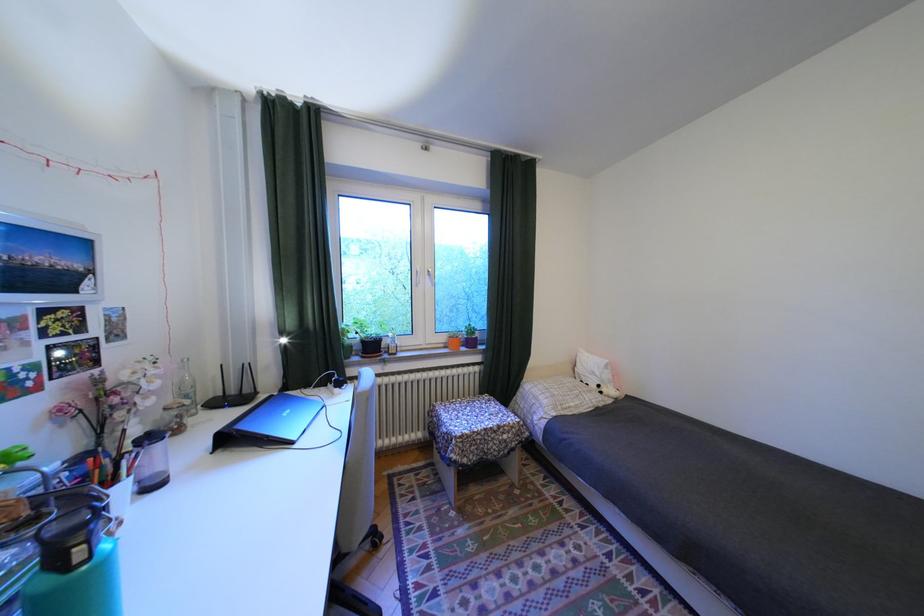
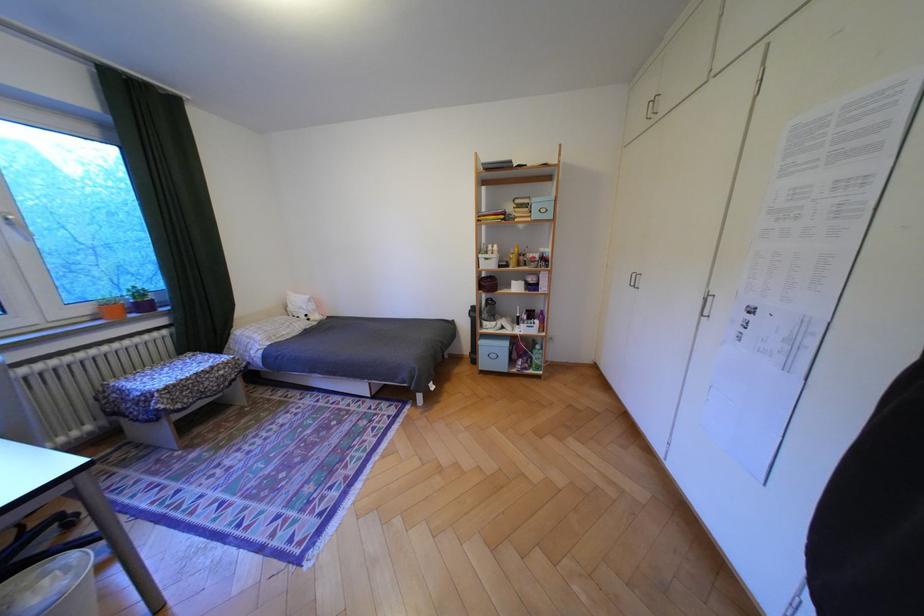
Locate, in the second image, the point that corresponds to (482,342) in the first image.

(155, 307)